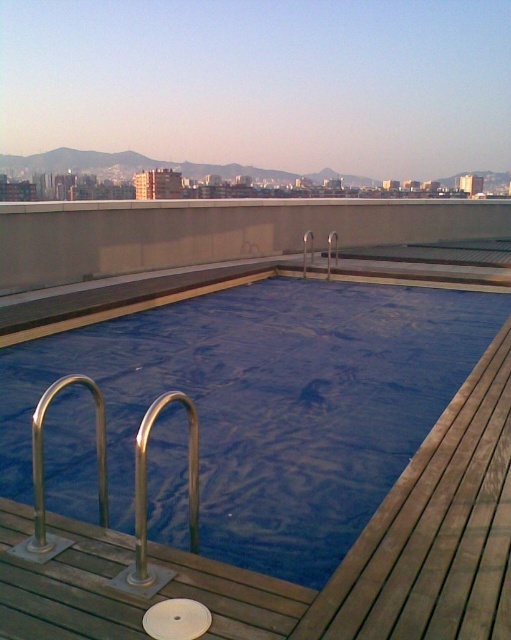
Question: Which point is closer to the camera taking this photo?

Choices:
 (A) (191, 500)
 (B) (109, 403)

Answer: (A)

Question: Is blue rubber pool at center thinner than silver metallic rail at center?

Choices:
 (A) no
 (B) yes

Answer: (A)

Question: Which of the following is the farthest from the observer?

Choices:
 (A) (74, 374)
 (B) (427, 300)

Answer: (B)

Question: Can you confirm if blue rubber pool at center is smaller than silver metallic rail at center?

Choices:
 (A) yes
 (B) no

Answer: (A)

Question: Can you confirm if blue rubber pool at center is positioned to the right of silver metallic rail at center?

Choices:
 (A) yes
 (B) no

Answer: (A)

Question: Which point is farther to the camera?

Choices:
 (A) (193, 545)
 (B) (362, 378)

Answer: (B)